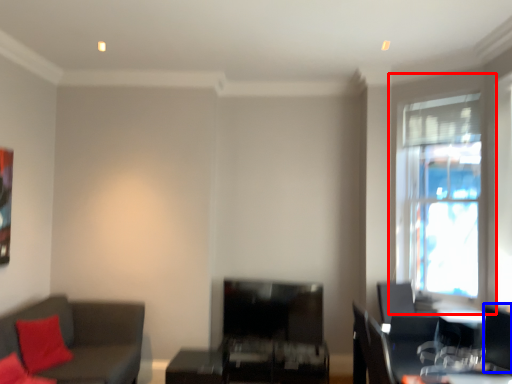
Question: Which object is further to the camera taking this photo, window (highlighted by a red box) or swivel chair (highlighted by a blue box)?

Choices:
 (A) window
 (B) swivel chair

Answer: (A)